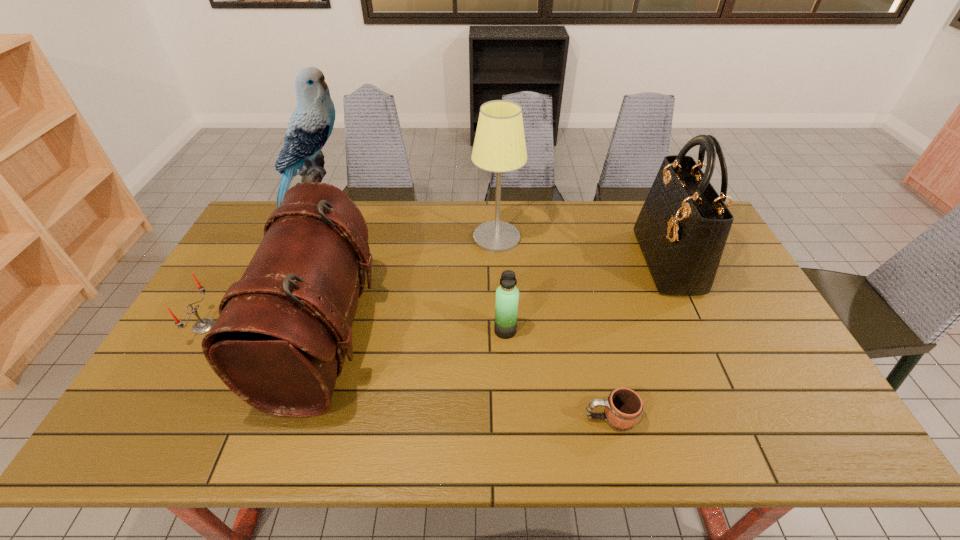
Find the location of a particular element. parakeet that is at the far edge is located at coordinates (311, 124).

This screenshot has width=960, height=540. I want to click on table lamp that is positioned at the far edge, so click(x=499, y=146).

The image size is (960, 540). Find the location of `handbag present at the far edge`. handbag present at the far edge is located at coordinates (682, 228).

This screenshot has height=540, width=960. In order to click on satchel located in the near edge section of the desktop in this screenshot , I will do click(284, 329).

Find the location of a particular element. The image size is (960, 540). mug located at the near edge is located at coordinates (623, 408).

Locate an element on the screen. This screenshot has height=540, width=960. parakeet positioned at the left edge is located at coordinates (311, 124).

This screenshot has width=960, height=540. I want to click on candle at the left edge, so click(204, 325).

The image size is (960, 540). What are the coordinates of `object that is at the right edge` in the screenshot? It's located at (682, 228).

Identify the location of object at the far left corner. The image size is (960, 540). (311, 124).

Locate an element on the screen. The width and height of the screenshot is (960, 540). object that is at the far right corner is located at coordinates (682, 228).